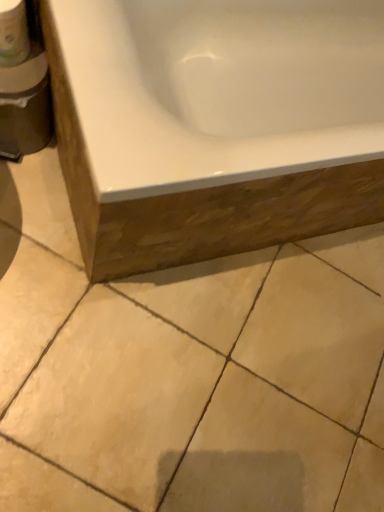
I want to click on free location above beige ceramic tile at lower center (from a real-world perspective), so click(224, 354).